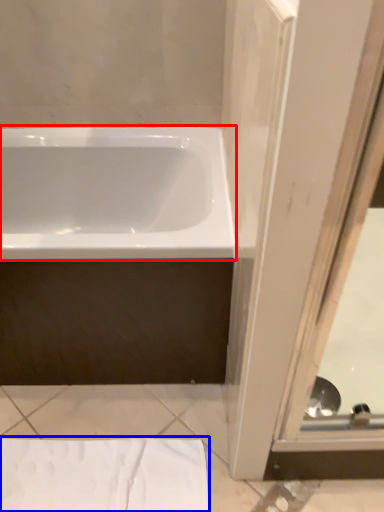
Question: Which point is closer to the camera, bathtub (highlighted by a red box) or sheet (highlighted by a blue box)?

Choices:
 (A) bathtub
 (B) sheet

Answer: (A)